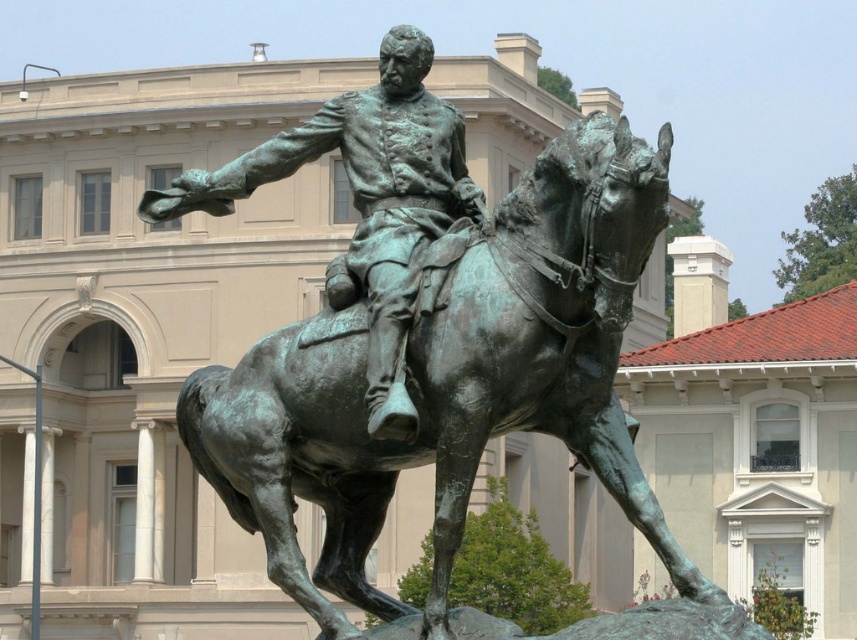
Question: Which object is farther from the camera taking this photo?

Choices:
 (A) green patina statue at center
 (B) green patina horse at center

Answer: (A)

Question: Which object appears closest to the camera in this image?

Choices:
 (A) green patina statue at center
 (B) green patina horse at center

Answer: (B)

Question: Considering the relative positions of green patina horse at center and green patina statue at center in the image provided, where is green patina horse at center located with respect to green patina statue at center?

Choices:
 (A) above
 (B) below

Answer: (B)

Question: Is green patina horse at center thinner than green patina statue at center?

Choices:
 (A) yes
 (B) no

Answer: (B)

Question: Does green patina horse at center have a larger size compared to green patina statue at center?

Choices:
 (A) no
 (B) yes

Answer: (B)